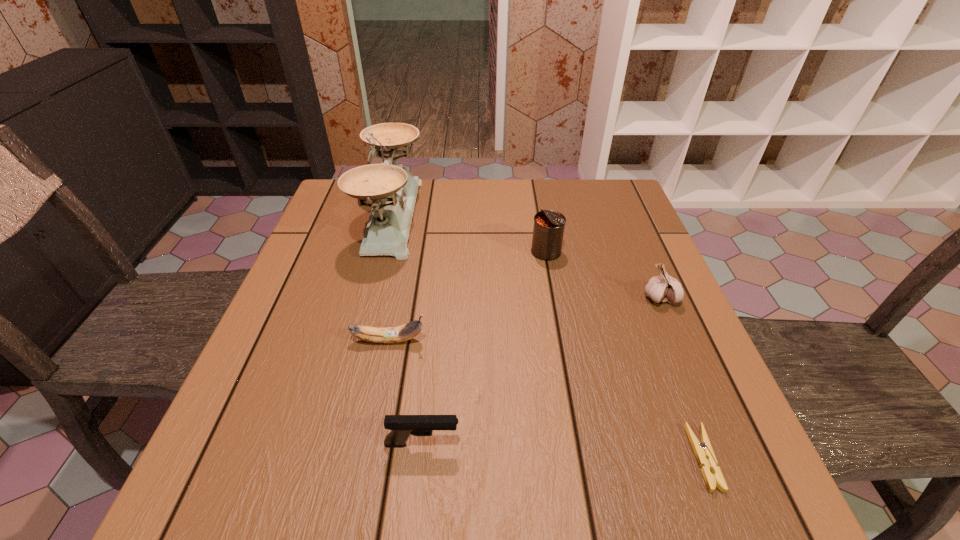
Identify the location of vacant space at the far edge of the desktop. (571, 207).

I want to click on free spot at the left edge of the desktop, so click(327, 279).

Find the location of a particular element. vacant space at the right edge is located at coordinates (728, 446).

You are a GUI agent. You are given a task and a screenshot of the screen. Output one action in this format:
    pyautogui.click(x=<x>, y=<y>)
    Task: Click on the vacant space at the far left corner of the desktop
    The width and height of the screenshot is (960, 540).
    Given the screenshot: What is the action you would take?
    pyautogui.click(x=334, y=219)

The image size is (960, 540). In order to click on free space at the near left corner in this screenshot , I will do `click(188, 503)`.

Identify the location of vacant space at the far right corner of the desktop. (591, 191).

Where is `vacant region between the third farthest object and the third object from right to left`? vacant region between the third farthest object and the third object from right to left is located at coordinates (603, 274).

This screenshot has height=540, width=960. I want to click on free space that is in between the banana and the tallest object, so click(x=391, y=278).

The height and width of the screenshot is (540, 960). What are the coordinates of `blank region between the scale and the clothespin` in the screenshot? It's located at (548, 337).

Where is `free space between the garlic and the third object from right to left`? This screenshot has height=540, width=960. free space between the garlic and the third object from right to left is located at coordinates (603, 274).